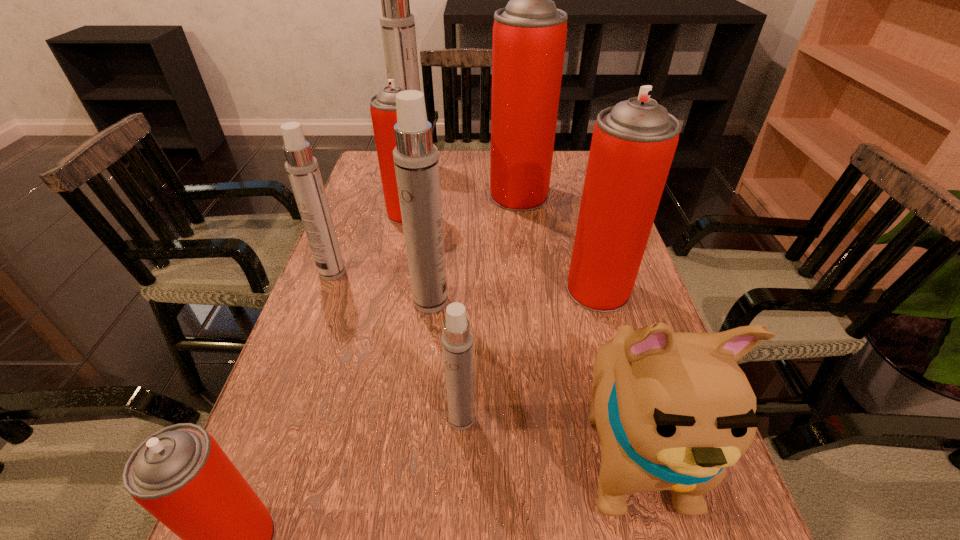
The height and width of the screenshot is (540, 960). Find the location of `the biggest red aerosol can`. the biggest red aerosol can is located at coordinates (529, 35).

At what (x,y) coordinates should I click in order to perform the action: click on the farthest white aerosol can. Please return your answer as a coordinate pair (x, y). This screenshot has height=540, width=960. Looking at the image, I should click on (397, 24).

This screenshot has height=540, width=960. I want to click on the farthest object, so click(397, 24).

Find the location of `the second nearest white aerosol can`. the second nearest white aerosol can is located at coordinates (416, 161).

Find the location of a particular element. the second biggest white aerosol can is located at coordinates (416, 161).

The height and width of the screenshot is (540, 960). In order to click on the second biggest red aerosol can in this screenshot , I will do `click(633, 144)`.

Find the location of a particular element. the third red aerosol can from right to left is located at coordinates (383, 110).

Where is `the second farthest white aerosol can`? Image resolution: width=960 pixels, height=540 pixels. the second farthest white aerosol can is located at coordinates (302, 168).

Identify the location of the third biggest white aerosol can. The image size is (960, 540). [x=302, y=168].

Where is `the sixth aerosol can from left to right`? This screenshot has width=960, height=540. the sixth aerosol can from left to right is located at coordinates (457, 339).